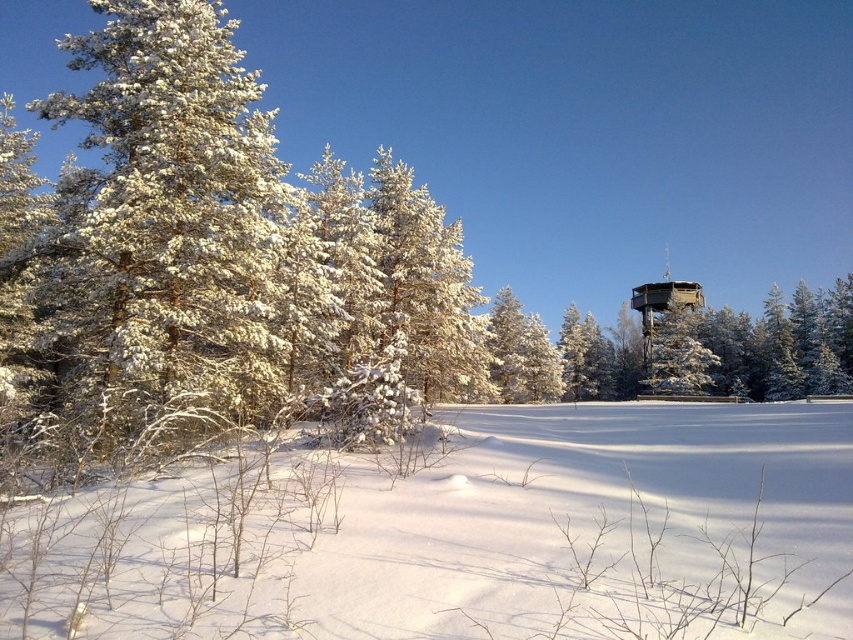
Can you confirm if white snow at center is positioned below snow-covered wooden tower at center?

No, white snow at center is not below snow-covered wooden tower at center.

Who is more distant from viewer, (x=792, y=454) or (x=698, y=381)?

The point (x=698, y=381) is more distant.

Where is `white snow at center`? white snow at center is located at coordinates (469, 536).